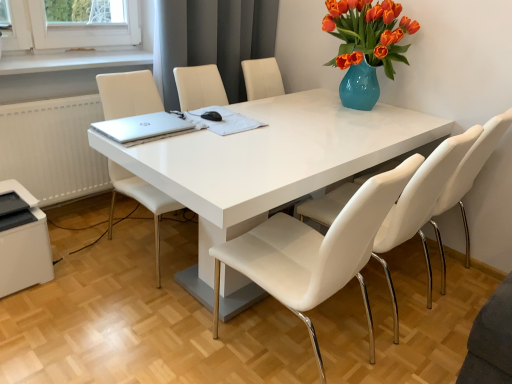
I want to click on vacant space to the right of silver metallic laptop at center, so click(200, 140).